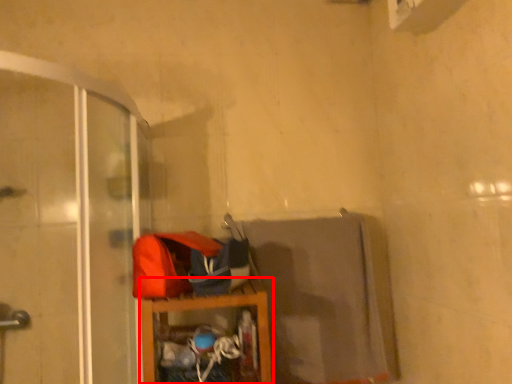
Question: From the image's perspective, what is the correct spatial relationship of furniture (annotated by the red box) in relation to screen door?

Choices:
 (A) below
 (B) above

Answer: (A)